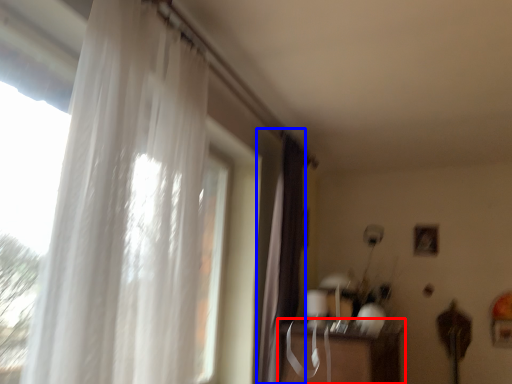
Question: Which object appears closest to the camera in this image, table (highlighted by a red box) or curtain (highlighted by a blue box)?

Choices:
 (A) table
 (B) curtain

Answer: (A)